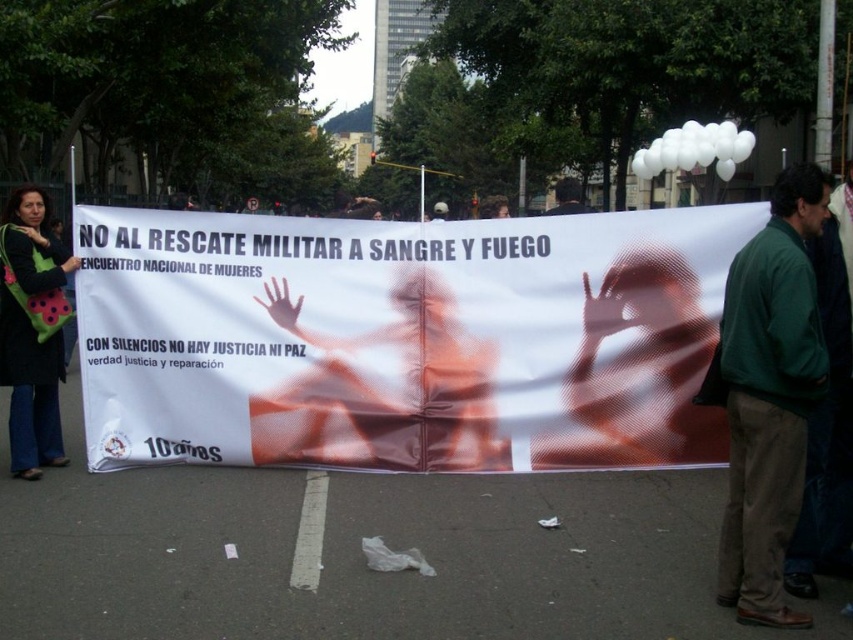
Is black felt bag at left above dark green jacket at center?

Actually, black felt bag at left is below dark green jacket at center.

Is black felt bag at left wider than dark green jacket at center?

No, black felt bag at left is not wider than dark green jacket at center.

Between point (38, 371) and point (440, 218), which one is positioned in front?

Point (38, 371) is more forward.

Image resolution: width=853 pixels, height=640 pixels. What are the coordinates of `black felt bag at left` in the screenshot? It's located at pyautogui.click(x=30, y=333).

Between white paper banner at center and black felt bag at left, which one appears on the left side from the viewer's perspective?

Positioned to the left is black felt bag at left.

Can you confirm if white paper banner at center is bigger than black felt bag at left?

Indeed, white paper banner at center has a larger size compared to black felt bag at left.

Who is more forward, (x=306, y=420) or (x=12, y=280)?

Positioned in front is point (x=12, y=280).

Where is `white paper banner at center`? This screenshot has height=640, width=853. white paper banner at center is located at coordinates (403, 339).

From the picture: Is dark brown hair at upper center above dark green jacket at center?

No, dark brown hair at upper center is not above dark green jacket at center.

You are a GUI agent. You are given a task and a screenshot of the screen. Output one action in this format:
    pyautogui.click(x=<x>, y=<y>)
    Task: Click on the dark brown hair at upper center
    Image resolution: width=853 pixels, height=640 pixels.
    Given the screenshot: What is the action you would take?
    pyautogui.click(x=567, y=196)

Between point (579, 182) and point (438, 205), which one is positioned in front?

Point (579, 182) is more forward.

Locate an element on the screen. dark brown hair at upper center is located at coordinates (567, 196).